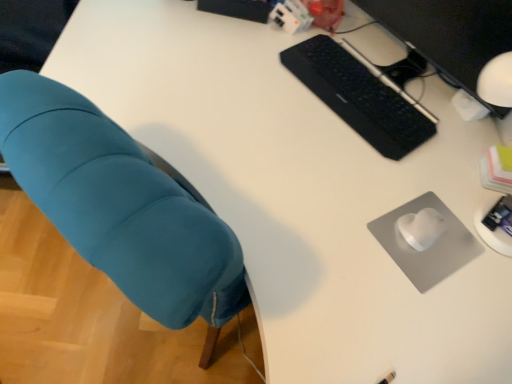
Image resolution: width=512 pixels, height=384 pixels. Identify the location of vacant space underneath black matte keyboard at upper right (from a real-world perspective). (356, 95).